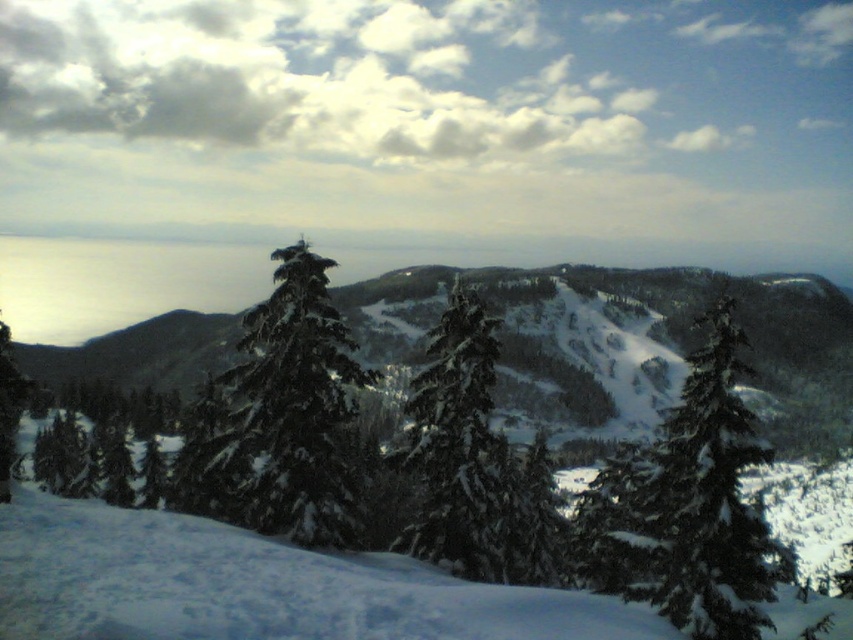
Question: Which object appears farthest from the camera in this image?

Choices:
 (A) green matte evergreen tree at center
 (B) green matte tree at center

Answer: (A)

Question: Is green matte tree at center positioned in front of green matte evergreen tree at center?

Choices:
 (A) no
 (B) yes

Answer: (B)

Question: Is green matte tree at center positioned in front of green matte evergreen tree at center?

Choices:
 (A) no
 (B) yes

Answer: (B)

Question: Does green matte tree at center have a greater width compared to green matte evergreen tree at center?

Choices:
 (A) no
 (B) yes

Answer: (B)